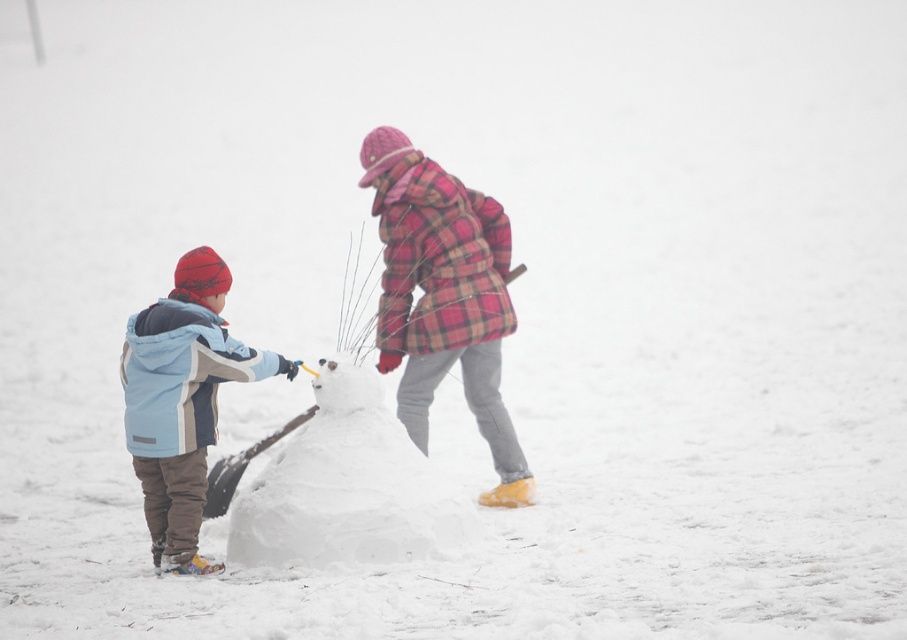
You are a photographer trying to capture both the plaid fabric coat at center and the light blue fleece jacket at left in a single shot. Which subject should you focus on first to ensure both are in frame?

You should focus on the plaid fabric coat at center first since it is closer to you than the light blue fleece jacket at left, ensuring both are within the frame.

You are standing in the snowy scene and want to find the plaid fabric coat at center. Based on the coordinates provided, where should you look to locate it?

The plaid fabric coat at center is located at the coordinates point (444, 298), so you should look there to find it.